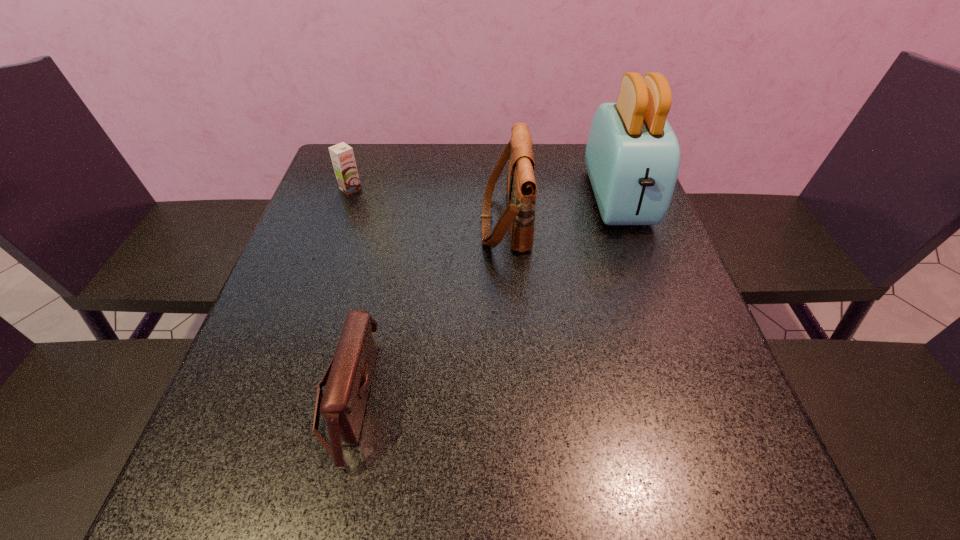
Locate an element on the screen. vacant space located on the front-facing side of the taller shoulder bag is located at coordinates (461, 220).

The height and width of the screenshot is (540, 960). Identify the location of vacant space located on the back of the leftmost object. (361, 158).

This screenshot has width=960, height=540. Find the location of `vacant space located 0.080m on the front flap of the second object from left to right`. vacant space located 0.080m on the front flap of the second object from left to right is located at coordinates (420, 396).

Locate an element on the screen. This screenshot has width=960, height=540. toaster situated at the far edge is located at coordinates (632, 157).

Locate an element on the screen. shoulder bag that is at the far edge is located at coordinates (521, 188).

This screenshot has width=960, height=540. Identify the location of chocolate milk at the far edge. 342,156.

Find the location of a particular element. object that is at the near edge is located at coordinates (348, 376).

The width and height of the screenshot is (960, 540). I want to click on object positioned at the left edge, so point(342,156).

At what (x,y) coordinates should I click in order to perform the action: click on object present at the right edge. Please return your answer as a coordinate pair (x, y). The width and height of the screenshot is (960, 540). Looking at the image, I should click on (632, 157).

Where is `object at the far left corner`? Image resolution: width=960 pixels, height=540 pixels. object at the far left corner is located at coordinates (342, 156).